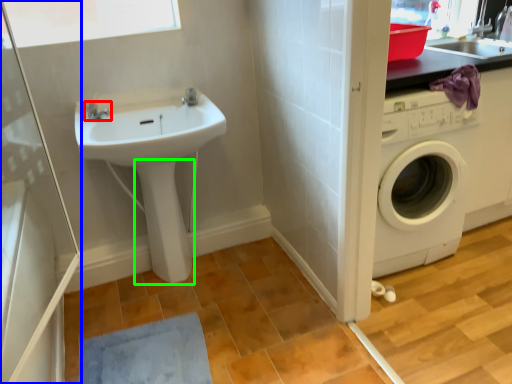
Question: Considering the real-world distances, which object is farthest from tap (highlighted by a red box)? screen door (highlighted by a blue box) or bidet (highlighted by a green box)?

Choices:
 (A) screen door
 (B) bidet

Answer: (A)